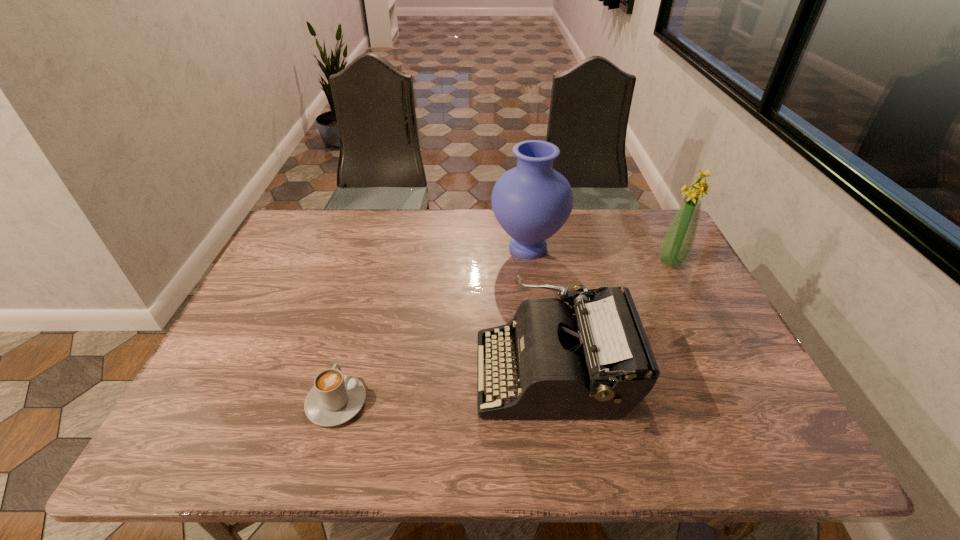
Identify the location of blank area located 0.200m on the front-facing side of the typewriter. The height and width of the screenshot is (540, 960). (391, 373).

Identify the location of vacant point located on the front-facing side of the typewriter. (447, 373).

Identify the location of vacant space located to the right of the shortest object. This screenshot has height=540, width=960. (362, 312).

At what (x,y) coordinates should I click in order to perform the action: click on vacant area situated to the right of the shortest object. Please return your answer as a coordinate pair (x, y). This screenshot has height=540, width=960. Looking at the image, I should click on (359, 323).

Where is `vacant region located to the right of the shortest object`? This screenshot has width=960, height=540. vacant region located to the right of the shortest object is located at coordinates click(x=371, y=281).

Where is `object positioned at the far edge`? object positioned at the far edge is located at coordinates (531, 202).

What are the coordinates of `typewriter that is at the near edge` in the screenshot? It's located at (594, 360).

Locate an element on the screen. The width and height of the screenshot is (960, 540). cappuccino that is at the near edge is located at coordinates [x=335, y=398].

Where is `object that is positioned at the right edge`? The width and height of the screenshot is (960, 540). object that is positioned at the right edge is located at coordinates (677, 244).

Where is `vacant space at the far edge of the desktop`? This screenshot has height=540, width=960. vacant space at the far edge of the desktop is located at coordinates (488, 247).